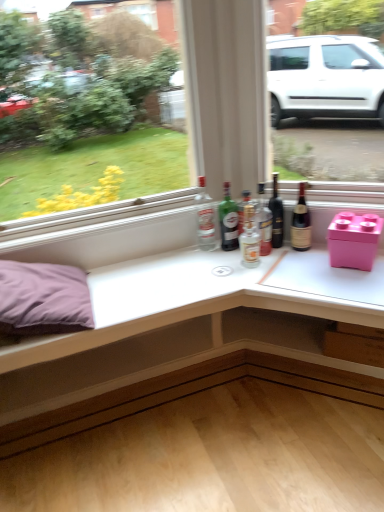
Find the location of a particular element. vacant space that's between translucent glass bottle at center, acting as the 2th bottle starting from the right, and brown glass bottle at right, the 1th bottle viewed from the right is located at coordinates (283, 251).